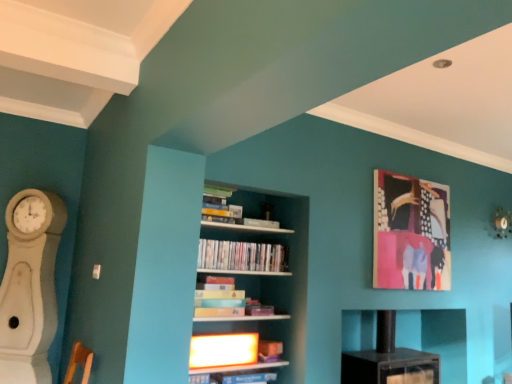
I want to click on matte black shelf at center, which is the second shelf from left to right, so click(436, 338).

The image size is (512, 384). Describe the element at coordinates (411, 233) in the screenshot. I see `abstract painting at upper right` at that location.

The image size is (512, 384). What do you see at coordinates (225, 300) in the screenshot? I see `matte cardboard book at center, the 2th book from the bottom` at bounding box center [225, 300].

Measure the distance between point (212, 243) and camera.

Point (212, 243) is 9.49 feet from camera.

Identify the location of matte plastic dvds at center, the second book from the top. This screenshot has width=512, height=384. (241, 256).

The height and width of the screenshot is (384, 512). Describe the element at coordinates (30, 286) in the screenshot. I see `white wood fireplace at left` at that location.

Find the location of `matte black shelf at center, marked as the 2th shelf in a front-to-back arrangement`. matte black shelf at center, marked as the 2th shelf in a front-to-back arrangement is located at coordinates (436, 338).

Identify the location of fireplace in front of the matte black shelf at center, which ranks as the 1th shelf in back-to-front order. This screenshot has height=384, width=512. (30, 286).

Is matte black shelf at center, which is the second shelf from left to right, surrounded by white wood fireplace at left?

No, matte black shelf at center, which is the second shelf from left to right, is not surrounded by white wood fireplace at left.

Does white wood fireplace at left turn towards matte black shelf at center, the 1th shelf in the right-to-left sequence?

No, white wood fireplace at left does not turn towards matte black shelf at center, the 1th shelf in the right-to-left sequence.

Does matte cardboard book at center, arranged as the third book when viewed from the top, appear on the right side of matte plastic book at center, the 1th book positioned from the bottom?

No, matte cardboard book at center, arranged as the third book when viewed from the top, is not to the right of matte plastic book at center, the 1th book positioned from the bottom.

Consider the image. Measure the distance between matte cardboard book at center, the 2th book from the bottom, and matte plastic book at center, the 4th book in the top-to-bottom sequence.

18.07 inches.

Based on the photo, does matte cardboard book at center, the 2th book from the bottom, have a larger size compared to matte plastic book at center, the 1th book positioned from the bottom?

Yes, matte cardboard book at center, the 2th book from the bottom, is bigger than matte plastic book at center, the 1th book positioned from the bottom.

Could you tell me if matte cardboard book at center, the 2th book from the bottom, is facing matte plastic book at center, the 1th book positioned from the bottom?

No, matte cardboard book at center, the 2th book from the bottom, is not aimed at matte plastic book at center, the 1th book positioned from the bottom.

Is matte plastic book at center, the 4th book in the top-to-bottom sequence, facing towards matte black shelf at center, the 1th shelf in the right-to-left sequence?

No, matte plastic book at center, the 4th book in the top-to-bottom sequence, is not turned towards matte black shelf at center, the 1th shelf in the right-to-left sequence.

Would you say matte plastic book at center, the 1th book positioned from the bottom, is a long distance from matte black shelf at center, marked as the 2th shelf in a front-to-back arrangement?

Yes, matte plastic book at center, the 1th book positioned from the bottom, and matte black shelf at center, marked as the 2th shelf in a front-to-back arrangement, are located far from each other.

Is matte plastic book at center, the 4th book in the top-to-bottom sequence, not inside matte black shelf at center, marked as the 2th shelf in a front-to-back arrangement?

Yes.

Between matte plastic book at center, the 4th book in the top-to-bottom sequence, and matte black shelf at center, marked as the 2th shelf in a front-to-back arrangement, which one has smaller width?

matte plastic book at center, the 4th book in the top-to-bottom sequence.

Locate an element on the screen. The width and height of the screenshot is (512, 384). the 3rd book to the left of the matte plastic book at center, the 1th book positioned from the bottom, starting your count from the anchor is located at coordinates (219, 204).

Does matte plastic book at center, the 1th book positioned from the bottom, have a lesser height compared to matte green book at upper center, positioned as the 4th book in bottom-to-top order?

Yes.

Can you tell me how much matte plastic book at center, the 1th book positioned from the bottom, and matte green book at upper center, positioned as the 4th book in bottom-to-top order, differ in facing direction?

The angular difference between matte plastic book at center, the 1th book positioned from the bottom, and matte green book at upper center, positioned as the 4th book in bottom-to-top order, is 0.00384 degrees.

Considering the sizes of abstract painting at upper right and white wooden bookcase at center in the image, is abstract painting at upper right taller or shorter than white wooden bookcase at center?

Considering their sizes, abstract painting at upper right has less height than white wooden bookcase at center.

Between point (447, 203) and point (284, 295), which one is positioned behind?

The point (447, 203) is behind.

Based on their positions, is abstract painting at upper right located to the left or right of white wooden bookcase at center?

From the image, it's evident that abstract painting at upper right is to the right of white wooden bookcase at center.

Is there a large distance between abstract painting at upper right and white wooden bookcase at center?

No, abstract painting at upper right is not far away from white wooden bookcase at center.

Based on the photo, is matte plastic dvds at center, the second book from the top, positioned in front of matte green book at upper center, positioned as the 4th book in bottom-to-top order?

Yes, it is in front of matte green book at upper center, positioned as the 4th book in bottom-to-top order.

Considering the sizes of objects matte plastic dvds at center, the second book from the top, and matte green book at upper center, positioned as the 4th book in bottom-to-top order, in the image provided, who is smaller, matte plastic dvds at center, the second book from the top, or matte green book at upper center, positioned as the 4th book in bottom-to-top order,?

Smaller between the two is matte plastic dvds at center, the second book from the top.

This screenshot has width=512, height=384. What are the coordinates of `book above the matte plastic dvds at center, the second book from the top (from the image's perspective)` in the screenshot? It's located at (219, 204).

Is matte plastic dvds at center, the second book from the top, aimed at white wood fireplace at left?

No, matte plastic dvds at center, the second book from the top, does not turn towards white wood fireplace at left.

Does matte plastic dvds at center, positioned as the third book in bottom-to-top order, have a smaller size compared to white wood fireplace at left?

Correct, matte plastic dvds at center, positioned as the third book in bottom-to-top order, occupies less space than white wood fireplace at left.

Find the location of a particular element. fireplace on the left of matte black shelf at center, the 1th shelf in the right-to-left sequence is located at coordinates (30, 286).

This screenshot has height=384, width=512. I want to click on book beneath the matte cardboard book at center, the 2th book from the bottom (from a real-world perspective), so click(x=269, y=351).

Based on their spatial positions, is matte white shelf at center, which is the second shelf in right-to-left order, or matte black shelf at center, which ranks as the 1th shelf in back-to-front order, further from white wooden bookcase at center?

matte black shelf at center, which ranks as the 1th shelf in back-to-front order.

Considering their positions, is matte black shelf at center, the 1th shelf in the right-to-left sequence, positioned closer to abstract painting at upper right than white wood fireplace at left?

The object closer to abstract painting at upper right is matte black shelf at center, the 1th shelf in the right-to-left sequence.

Which object lies nearer to the anchor point abstract painting at upper right, matte plastic dvds at center, positioned as the third book in bottom-to-top order, or matte black shelf at center, which ranks as the 1th shelf in back-to-front order?

Based on the image, matte black shelf at center, which ranks as the 1th shelf in back-to-front order, appears to be nearer to abstract painting at upper right.

Estimate the real-world distances between objects in this image. Which object is closer to white wood fireplace at left, matte plastic dvds at center, the second book from the top, or matte white shelf at center, which is the first shelf from left to right?

matte white shelf at center, which is the first shelf from left to right, lies closer to white wood fireplace at left than the other object.

Considering their positions, is abstract painting at upper right positioned closer to matte plastic book at center, the 1th book positioned from the bottom, than matte white shelf at center, which is the second shelf in right-to-left order?

matte white shelf at center, which is the second shelf in right-to-left order.

From the image, which object appears to be nearer to matte green book at upper center, positioned as the 4th book in bottom-to-top order, matte white shelf at center, which is the first shelf from left to right, or abstract painting at upper right?

The object closer to matte green book at upper center, positioned as the 4th book in bottom-to-top order, is matte white shelf at center, which is the first shelf from left to right.

Considering their positions, is matte plastic dvds at center, positioned as the third book in bottom-to-top order, positioned further to white wood fireplace at left than abstract painting at upper right?

The object further to white wood fireplace at left is abstract painting at upper right.

Considering their positions, is matte plastic dvds at center, positioned as the third book in bottom-to-top order, positioned closer to white wooden bookcase at center than matte white shelf at center, marked as the 1th shelf in a front-to-back arrangement?

matte plastic dvds at center, positioned as the third book in bottom-to-top order, is positioned closer to the anchor white wooden bookcase at center.

The height and width of the screenshot is (384, 512). I want to click on shelf between matte plastic book at center, the 1th book positioned from the bottom, and abstract painting at upper right, in the horizontal direction, so click(436, 338).

Identify the location of book located between white wood fireplace at left and matte cardboard book at center, the 2th book from the bottom, in the left-right direction. (219, 204).

Find the location of a particular element. The image size is (512, 384). bookcase between matte plastic dvds at center, the second book from the top, and matte plastic book at center, the 4th book in the top-to-bottom sequence, in the up-down direction is located at coordinates (274, 273).

This screenshot has height=384, width=512. Identify the location of bookcase between matte plastic dvds at center, positioned as the third book in bottom-to-top order, and matte white shelf at center, acting as the second shelf starting from the back, in the vertical direction. (274, 273).